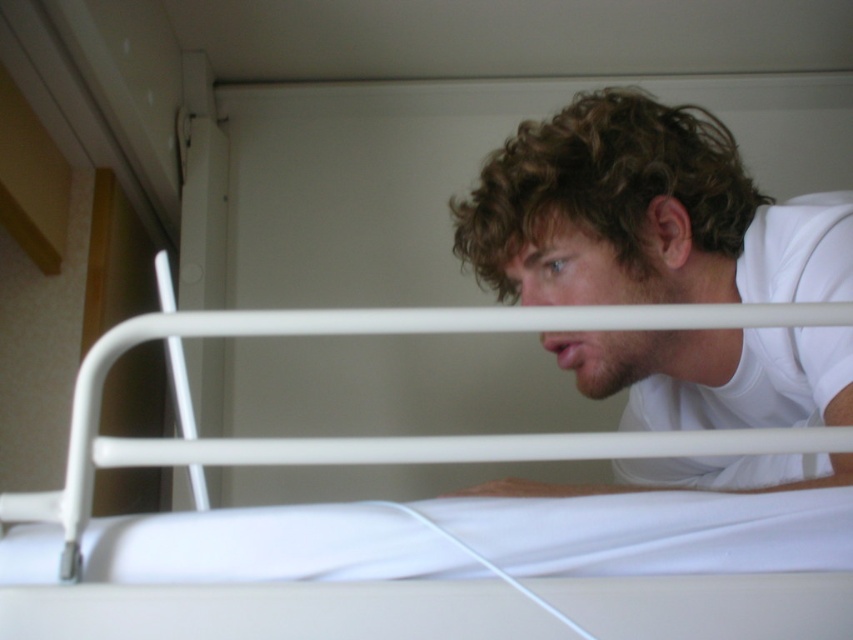
Question: Can you confirm if white matte shirt at upper right is positioned above white metal bunk bed at center?

Choices:
 (A) no
 (B) yes

Answer: (B)

Question: Is white matte shirt at upper right to the left of white metal bunk bed at center from the viewer's perspective?

Choices:
 (A) no
 (B) yes

Answer: (A)

Question: Which point is closer to the camera?

Choices:
 (A) white matte shirt at upper right
 (B) white metal bunk bed at center

Answer: (B)

Question: Is the position of white matte shirt at upper right less distant than that of white metal bunk bed at center?

Choices:
 (A) yes
 (B) no

Answer: (B)